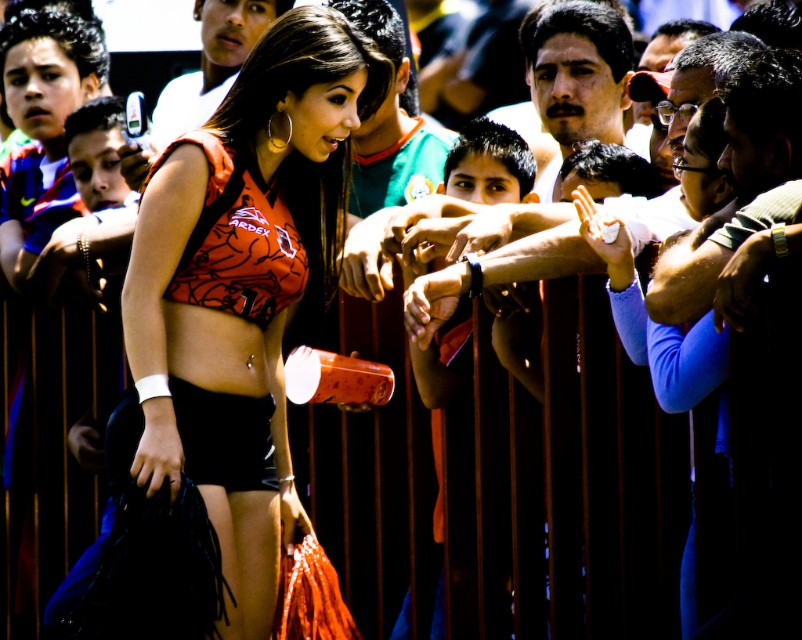
Question: Is matte orange jersey at center wider than orange matte bikini top at center?

Choices:
 (A) no
 (B) yes

Answer: (B)

Question: Does matte orange jersey at center appear over orange matte bikini top at center?

Choices:
 (A) yes
 (B) no

Answer: (B)

Question: Considering the relative positions of matte orange jersey at center and orange matte bikini top at center in the image provided, where is matte orange jersey at center located with respect to orange matte bikini top at center?

Choices:
 (A) left
 (B) right

Answer: (A)

Question: Which object is closer to the camera taking this photo?

Choices:
 (A) matte orange jersey at center
 (B) orange matte bikini top at center

Answer: (A)